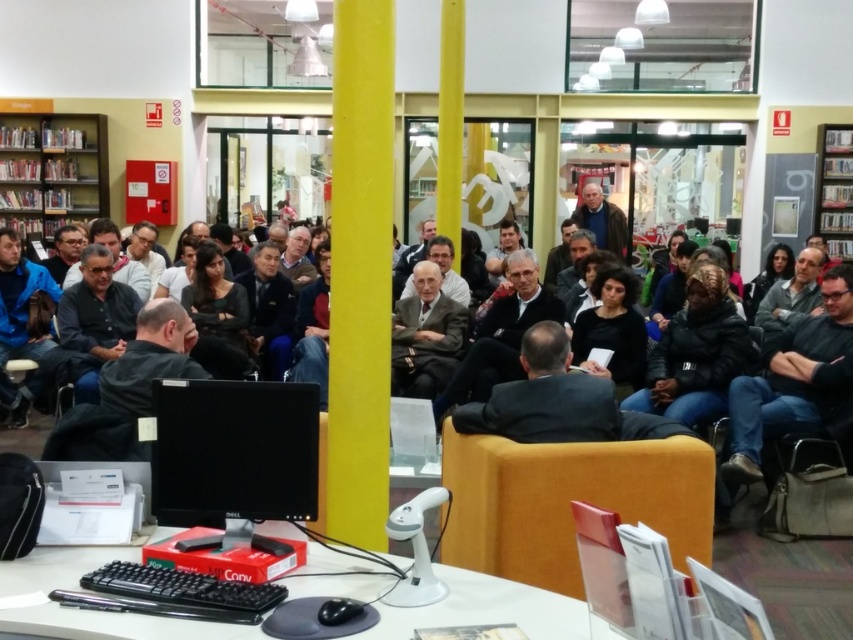
Question: Observing the image, what is the correct spatial positioning of light brown suit at center in reference to metallic silver bookshelf at upper right?

Choices:
 (A) right
 (B) left

Answer: (B)

Question: Can you confirm if orange fabric chair at center is thinner than light brown suit at center?

Choices:
 (A) yes
 (B) no

Answer: (B)

Question: Is black plastic table at lower center further to the viewer compared to wooden bookshelf at upper left?

Choices:
 (A) no
 (B) yes

Answer: (A)

Question: Based on their relative distances, which object is nearer to the black plastic table at lower center?

Choices:
 (A) orange fabric chair at center
 (B) wooden bookshelf at upper left
 (C) light brown suit at center
 (D) black glossy monitor at center

Answer: (D)

Question: Which point is farther to the camera?

Choices:
 (A) (735, 454)
 (B) (207, 392)
 (C) (602, 237)

Answer: (C)

Question: Which object is positioned closest to the orange fabric chair at center?

Choices:
 (A) black plastic table at lower center
 (B) light brown suit at center
 (C) black glossy monitor at center

Answer: (A)